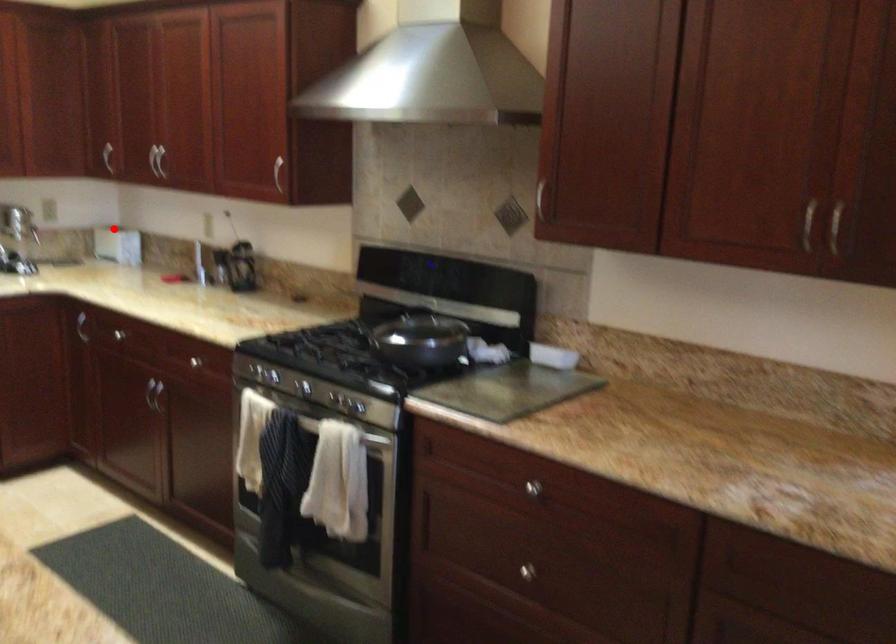
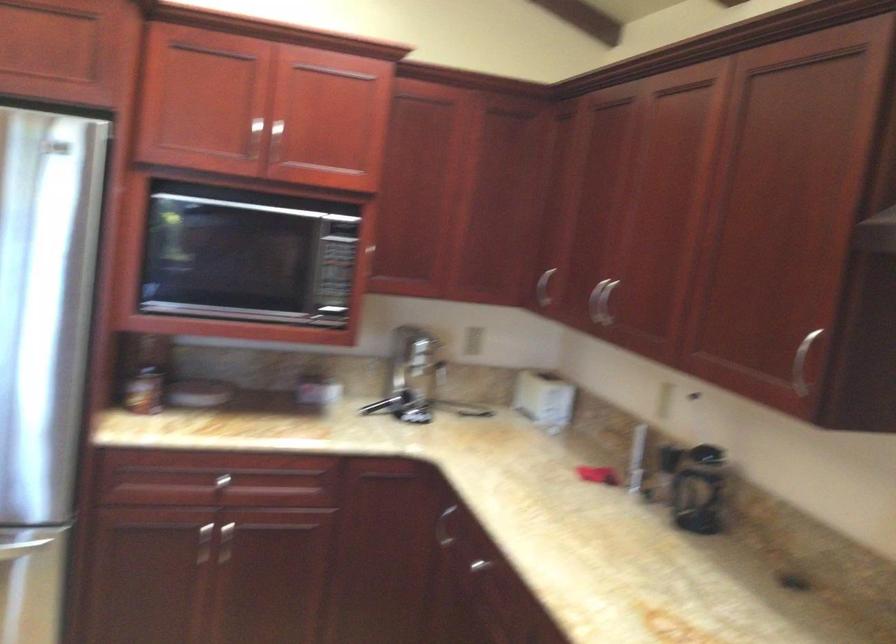
The point at the highlighted location is marked in the first image. Where is the corresponding point in the second image?

(544, 398)